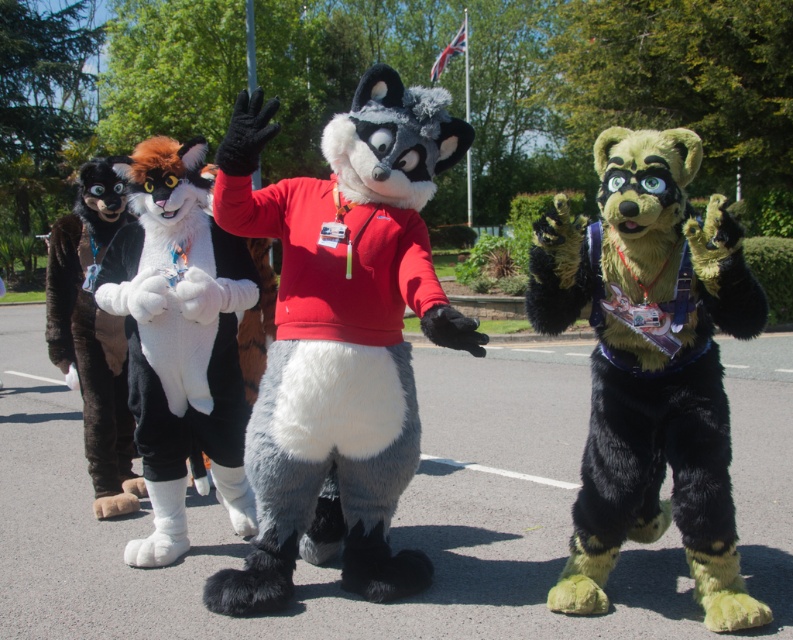
You are a photographer trying to capture a clear photo of the white plush cat at center without the fluffy green fur at center blocking it. What should you do?

Move the camera backward to create more distance between the camera and the subjects so that the fluffy green fur at center is no longer in front of the white plush cat at center.

You are organizing a photo shoot and need to arrange the fluffy green fur at center and the white plush cat at center so that both are visible in the frame. Based on their heights, which one should be placed closer to the front to ensure both are visible?

The fluffy green fur at center is shorter than the white plush cat at center, so placing the fluffy green fur at center closer to the front will ensure both are visible in the frame.

You are a photographer trying to capture a group photo of the four fursuiters. You want to ensure that the fluffy green fur at center is positioned exactly at the center of the image. Is the current positioning correct?

The fluffy green fur at center is already positioned at point (650, 365), which is close to the center coordinates of an image, so it is correctly positioned.